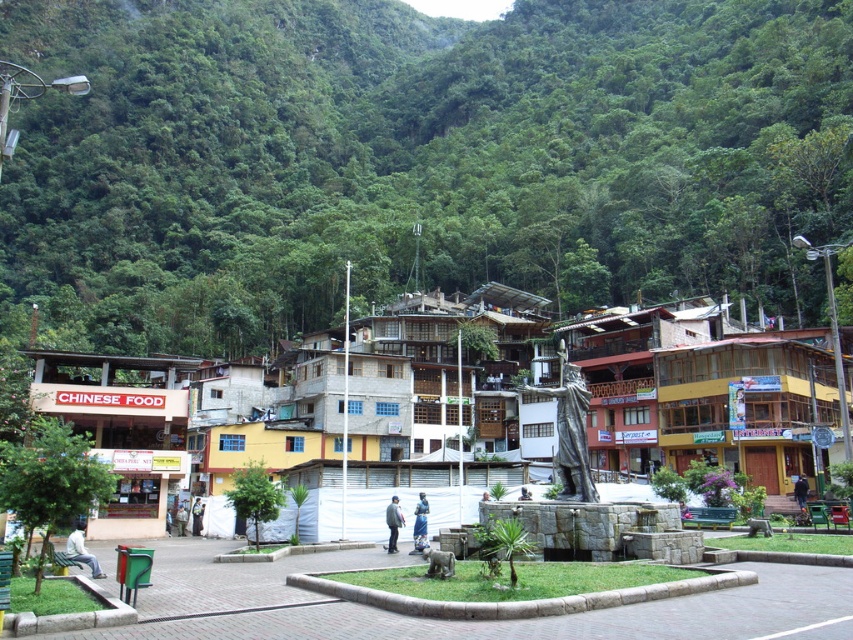
What do you see at coordinates (413, 161) in the screenshot? The height and width of the screenshot is (640, 853). I see `green leafy forest at upper center` at bounding box center [413, 161].

Who is more forward, (308, 218) or (804, 492)?

Point (804, 492) is in front.

Locate an element on the screen. This screenshot has width=853, height=640. green leafy forest at upper center is located at coordinates (413, 161).

Does green leafy forest at upper center have a greater width compared to dark gray jacket at center?

Indeed, green leafy forest at upper center has a greater width compared to dark gray jacket at center.

Where is `green leafy forest at upper center`? The image size is (853, 640). green leafy forest at upper center is located at coordinates (413, 161).

How far apart are light blue fabric bench at lower left and blue metallic statue at center?

light blue fabric bench at lower left and blue metallic statue at center are 15.15 meters apart from each other.

Is light blue fabric bench at lower left to the right of blue metallic statue at center from the viewer's perspective?

No, light blue fabric bench at lower left is not to the right of blue metallic statue at center.

Between point (91, 563) and point (425, 504), which one is positioned behind?

Positioned behind is point (425, 504).

Identify the location of light blue fabric bench at lower left. Image resolution: width=853 pixels, height=640 pixels. (80, 550).